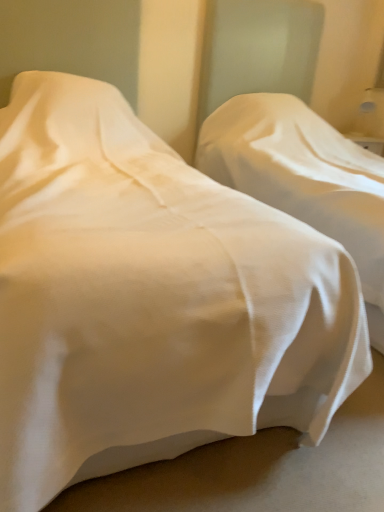
Image resolution: width=384 pixels, height=512 pixels. What do you see at coordinates (303, 178) in the screenshot?
I see `white cotton bed at center` at bounding box center [303, 178].

In order to click on white cotton bed at center in this screenshot , I will do `click(303, 178)`.

Find the location of a particular element. The width and height of the screenshot is (384, 512). white cotton bed at center is located at coordinates [303, 178].